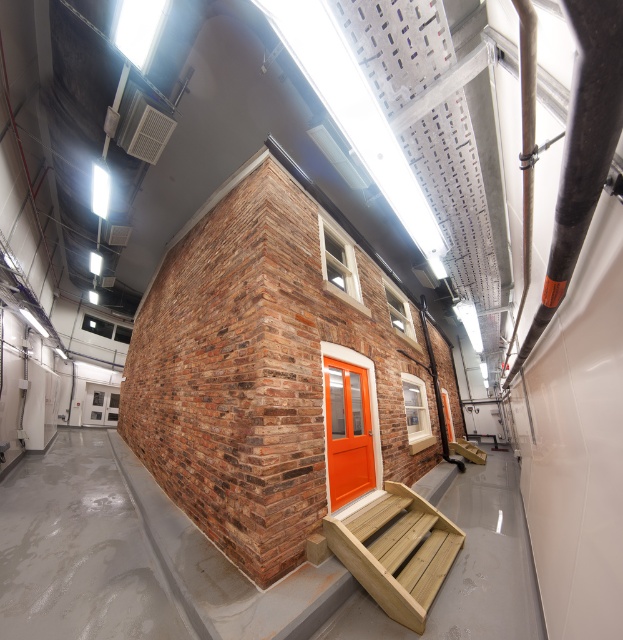
Can you confirm if brown brick at center is thinner than orange glossy door at center?

Yes.

Is point (219, 541) closer to viewer compared to point (358, 372)?

Yes, it is in front of point (358, 372).

Is point (181, 336) less distant than point (328, 432)?

No.

Locate an element on the screen. brown brick at center is located at coordinates (278, 372).

Which is more to the right, natural wood bench at lower center or wooden bench at center?

From the viewer's perspective, wooden bench at center appears more on the right side.

Can you confirm if natural wood bench at lower center is shorter than wooden bench at center?

No.

Which is in front, point (340, 531) or point (459, 444)?

Point (340, 531) is in front.

Where is `natural wood bench at lower center`? natural wood bench at lower center is located at coordinates (397, 552).

Can you confirm if orange glossy door at center is smaller than wooden bench at center?

Actually, orange glossy door at center might be larger than wooden bench at center.

Is orange glossy door at center to the right of wooden bench at center from the viewer's perspective?

No, orange glossy door at center is not to the right of wooden bench at center.

Is point (350, 474) more distant than point (478, 449)?

That is False.

Find the location of a particular element. The width and height of the screenshot is (623, 640). orange glossy door at center is located at coordinates (348, 432).